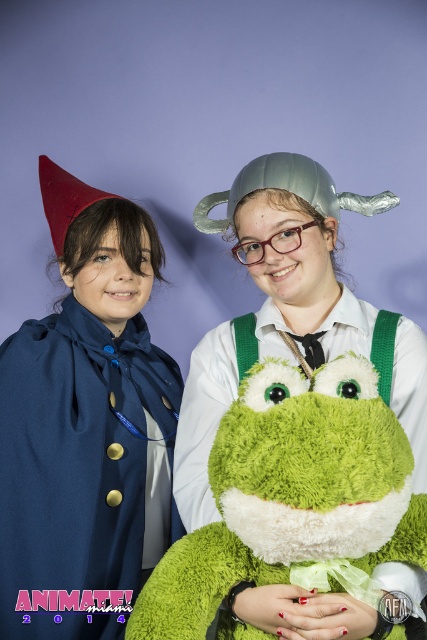
Question: Which of the following is the farthest from the observer?

Choices:
 (A) green plush frog at center
 (B) matte blue cape at left

Answer: (B)

Question: Among these objects, which one is farthest from the camera?

Choices:
 (A) matte blue cape at left
 (B) green plush frog at center

Answer: (A)

Question: Can you confirm if matte blue cape at left is thinner than green plush frog at center?

Choices:
 (A) no
 (B) yes

Answer: (B)

Question: Can you confirm if matte blue cape at left is bigger than green plush frog at center?

Choices:
 (A) yes
 (B) no

Answer: (A)

Question: Does matte blue cape at left have a greater width compared to green plush frog at center?

Choices:
 (A) yes
 (B) no

Answer: (B)

Question: Which point is closer to the camera?

Choices:
 (A) green plush frog at center
 (B) matte blue cape at left

Answer: (A)